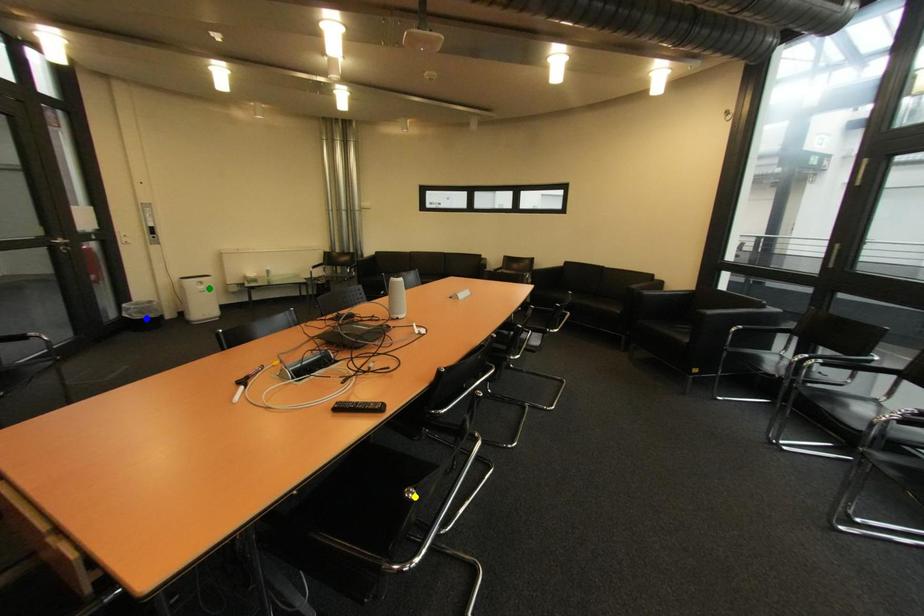
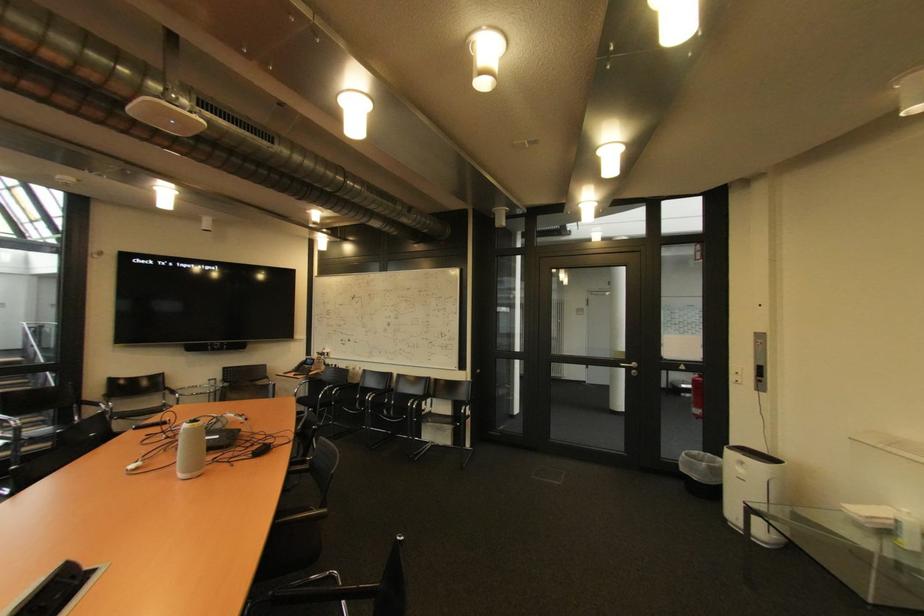
I am providing you with two images of the same scene from different viewpoints. Three points are marked in image1. Which point corresponds to a part or object that is occluded in image2?In image1, three points are marked. Which of them correspond to a part or object that is occluded in image2?Among the three points shown in image1, which one corresponds to a part or object that is no longer visible due to occlusion in image2?

Invisible in image2: yellow point.